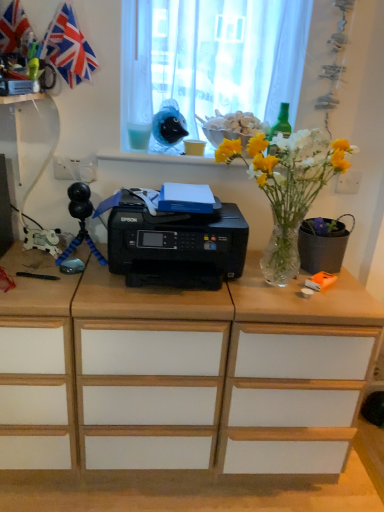
What do you see at coordinates (174, 244) in the screenshot? Image resolution: width=384 pixels, height=512 pixels. I see `black plastic printer at center` at bounding box center [174, 244].

You are a GUI agent. You are given a task and a screenshot of the screen. Output one action in this format:
    pyautogui.click(x=<x>, y=<y>)
    Task: Click on the white plastic socket at upper left
    
    Given the screenshot: What is the action you would take?
    pyautogui.click(x=75, y=169)

Describe the element at coordinates (75, 169) in the screenshot. I see `white plastic socket at upper left` at that location.

This screenshot has width=384, height=512. What do you see at coordinates (68, 48) in the screenshot?
I see `red fabric flag at upper left` at bounding box center [68, 48].

You are a GUI agent. You are given a task and a screenshot of the screen. Output one action in this format:
    pyautogui.click(x=<x>, y=<y>)
    Task: Click on the white paper cup at upper center, the second stationery positioned from the right
    
    Given the screenshot: What is the action you would take?
    pyautogui.click(x=194, y=147)

Identify the location of black plastic printer at center. (174, 244).

How distant is red fabric flag at upper left from green glass bottle at upper right, which ranks as the 1th stationery in right-to-left order?

red fabric flag at upper left and green glass bottle at upper right, which ranks as the 1th stationery in right-to-left order, are 26.65 inches apart.

Which is behind, red fabric flag at upper left or green glass bottle at upper right, the 2th stationery viewed from the left?

Positioned behind is green glass bottle at upper right, the 2th stationery viewed from the left.

From the image's perspective, relative to green glass bottle at upper right, which ranks as the 1th stationery in right-to-left order, is red fabric flag at upper left above or below?

Clearly, from the image's perspective, red fabric flag at upper left is above green glass bottle at upper right, which ranks as the 1th stationery in right-to-left order.

Is red fabric flag at upper left far from green glass bottle at upper right, which ranks as the 1th stationery in right-to-left order?

No, red fabric flag at upper left is in close proximity to green glass bottle at upper right, which ranks as the 1th stationery in right-to-left order.

From a real-world perspective, is green glass bottle at upper right, the 2th stationery viewed from the left, positioned above or below red fabric flag at upper left?

In terms of real-world spatial position, green glass bottle at upper right, the 2th stationery viewed from the left, is below red fabric flag at upper left.

Can you confirm if green glass bottle at upper right, the 2th stationery viewed from the left, is smaller than red fabric flag at upper left?

Indeed, green glass bottle at upper right, the 2th stationery viewed from the left, has a smaller size compared to red fabric flag at upper left.

Is green glass bottle at upper right, which ranks as the 1th stationery in right-to-left order, oriented away from red fabric flag at upper left?

No, red fabric flag at upper left is not at the back of green glass bottle at upper right, which ranks as the 1th stationery in right-to-left order.

Is green glass bottle at upper right, the 2th stationery viewed from the left, at the right side of red fabric flag at upper left?

Correct, you'll find green glass bottle at upper right, the 2th stationery viewed from the left, to the right of red fabric flag at upper left.

Which is more to the right, white plastic socket at upper left or black matte flowerpot at right?

Positioned to the right is black matte flowerpot at right.

Can you confirm if white plastic socket at upper left is taller than black matte flowerpot at right?

Incorrect, the height of white plastic socket at upper left is not larger of that of black matte flowerpot at right.

From a real-world perspective, is white plastic socket at upper left positioned above or below black matte flowerpot at right?

In terms of real-world spatial position, white plastic socket at upper left is above black matte flowerpot at right.

Which of these two, white plastic socket at upper left or black matte flowerpot at right, is thinner?

white plastic socket at upper left.

From a real-world perspective, which object rests below the other?

In real-world perspective, black plastic printer at center is lower.

Considering the relative positions of black plastic printer at center and white plastic socket at upper left in the image provided, is black plastic printer at center to the left of white plastic socket at upper left from the viewer's perspective?

Incorrect, black plastic printer at center is not on the left side of white plastic socket at upper left.

Is black plastic printer at center turned away from white plastic socket at upper left?

No, black plastic printer at center's orientation is not away from white plastic socket at upper left.

Is black matte flowerpot at right in front of white plastic socket at upper left?

Yes.

Would you say black matte flowerpot at right is inside or outside white plastic socket at upper left?

black matte flowerpot at right lies outside white plastic socket at upper left.

Could you tell me if black matte flowerpot at right is turned towards white plastic socket at upper left?

No, black matte flowerpot at right is not facing towards white plastic socket at upper left.

Is point (321, 236) closer to viewer compared to point (68, 178)?

Yes.

You are a GUI agent. You are given a task and a screenshot of the screen. Output one action in this format:
    pyautogui.click(x=<x>, y=<y>)
    Task: Click on the electric outlet that is on the left side of clear glass vase at center
    The image size is (384, 512).
    Given the screenshot: What is the action you would take?
    pyautogui.click(x=75, y=169)

Would you consider clear glass vase at center to be distant from white plastic socket at upper left?

No, clear glass vase at center is in close proximity to white plastic socket at upper left.

Consider the image. From the image's perspective, is clear glass vase at center above or below white plastic socket at upper left?

Clearly, from the image's perspective, clear glass vase at center is below white plastic socket at upper left.

Considering their positions, is clear glass vase at center located in front of or behind white plastic socket at upper left?

clear glass vase at center is positioned closer to the viewer than white plastic socket at upper left.

Based on the photo, can you confirm if black matte flowerpot at right is positioned to the right of green glass bottle at upper right, which ranks as the 1th stationery in right-to-left order?

Correct, you'll find black matte flowerpot at right to the right of green glass bottle at upper right, which ranks as the 1th stationery in right-to-left order.

From a real-world perspective, is black matte flowerpot at right positioned above or below green glass bottle at upper right, which ranks as the 1th stationery in right-to-left order?

From a real-world perspective, black matte flowerpot at right is physically below green glass bottle at upper right, which ranks as the 1th stationery in right-to-left order.

Can you confirm if black matte flowerpot at right is thinner than green glass bottle at upper right, which ranks as the 1th stationery in right-to-left order?

No, black matte flowerpot at right is not thinner than green glass bottle at upper right, which ranks as the 1th stationery in right-to-left order.

At what (x,y) coordinates should I click in order to perform the action: click on flag lying above the green glass bottle at upper right, which ranks as the 1th stationery in right-to-left order (from the image's perspective). Please return your answer as a coordinate pair (x, y). Looking at the image, I should click on (68, 48).

This screenshot has width=384, height=512. What are the coordinates of `the 1st stationery positioned below the red fabric flag at upper left (from the image's perspective)` in the screenshot? It's located at (281, 122).

When comparing their distances from white plastic socket at upper left, does green glass bottle at upper right, the 2th stationery viewed from the left, or clear glass vase at center seem closer?

The object closer to white plastic socket at upper left is green glass bottle at upper right, the 2th stationery viewed from the left.

From the image, which object appears to be nearer to red fabric flag at upper left, clear glass vase at center or white plastic socket at upper left?

The object closer to red fabric flag at upper left is white plastic socket at upper left.

Based on their spatial positions, is black plastic printer at center or clear glass vase at center further from white paper cup at upper center, placed as the 1th stationery when sorted from left to right?

black plastic printer at center is further to white paper cup at upper center, placed as the 1th stationery when sorted from left to right.

Which object lies nearer to the anchor point white paper cup at upper center, placed as the 1th stationery when sorted from left to right, white sheer curtain at upper center or green glass bottle at upper right, which ranks as the 1th stationery in right-to-left order?

The object closer to white paper cup at upper center, placed as the 1th stationery when sorted from left to right, is green glass bottle at upper right, which ranks as the 1th stationery in right-to-left order.

Looking at the image, which one is located further to red fabric flag at upper left, black plastic printer at center or clear glass vase at center?

Among the two, clear glass vase at center is located further to red fabric flag at upper left.

From the image, which object appears to be nearer to black plastic printer at center, clear glass vase at center or white plastic socket at upper left?

Based on the image, clear glass vase at center appears to be nearer to black plastic printer at center.

Looking at the image, which one is located closer to black plastic printer at center, clear glass vase at center or green glass bottle at upper right, the 2th stationery viewed from the left?

clear glass vase at center.

Based on their spatial positions, is clear glass vase at center or white paper cup at upper center, the second stationery positioned from the right, further from black matte flowerpot at right?

The object further to black matte flowerpot at right is white paper cup at upper center, the second stationery positioned from the right.

You are a GUI agent. You are given a task and a screenshot of the screen. Output one action in this format:
    pyautogui.click(x=<x>, y=<y>)
    Task: Click on the stationery located between red fabric flag at upper left and green glass bottle at upper right, the 2th stationery viewed from the left, in the left-right direction
    
    Given the screenshot: What is the action you would take?
    pyautogui.click(x=194, y=147)

This screenshot has height=512, width=384. I want to click on printer between white plastic socket at upper left and black matte flowerpot at right in the horizontal direction, so click(x=174, y=244).

Image resolution: width=384 pixels, height=512 pixels. Find the location of `printer between clear glass vase at center and green glass bottle at upper right, the 2th stationery viewed from the left, in the front-back direction`. printer between clear glass vase at center and green glass bottle at upper right, the 2th stationery viewed from the left, in the front-back direction is located at coordinates (174, 244).

I want to click on printer situated between white plastic socket at upper left and clear glass vase at center from left to right, so click(174, 244).